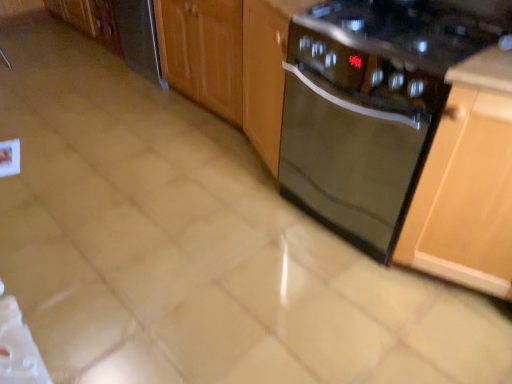
Question: Is point (241, 41) positioned closer to the camera than point (475, 49)?

Choices:
 (A) farther
 (B) closer

Answer: (A)

Question: In the image, is glossy wood cabinet at center, the second cabinetry in the bottom-to-top sequence, on the left side or the right side of black glass dishwasher at center?

Choices:
 (A) right
 (B) left

Answer: (B)

Question: Which of these objects is positioned closest to the glossy wood cabinet at center, which is counted as the 2th cabinetry, starting from the front?

Choices:
 (A) black glass gas stove at upper right
 (B) satin stainless steel dishwasher at left
 (C) black glass dishwasher at center
 (D) wooden cabinet at right, which appears as the 1th cabinetry when viewed from the right

Answer: (C)

Question: Which of these objects is positioned farthest from the black glass dishwasher at center?

Choices:
 (A) satin stainless steel dishwasher at left
 (B) wooden cabinet at right, the second cabinetry positioned from the top
 (C) glossy wood cabinet at center, placed as the second cabinetry when sorted from right to left
 (D) black glass gas stove at upper right

Answer: (A)